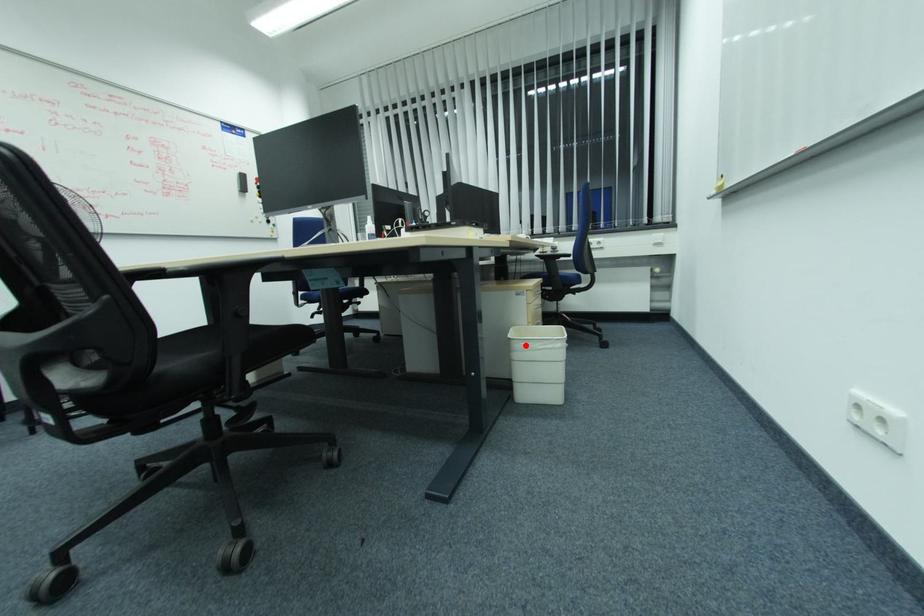
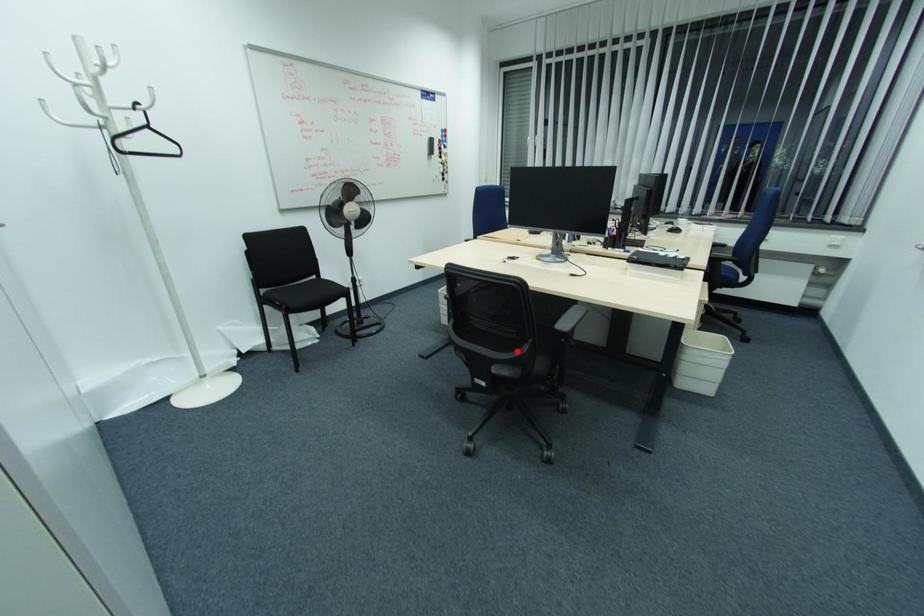
I am providing you with two images of the same scene from different viewpoints. A red point is marked on the first image and another point is marked on the second image. Is the marked point in image1 the same physical position as the marked point in image2?

No